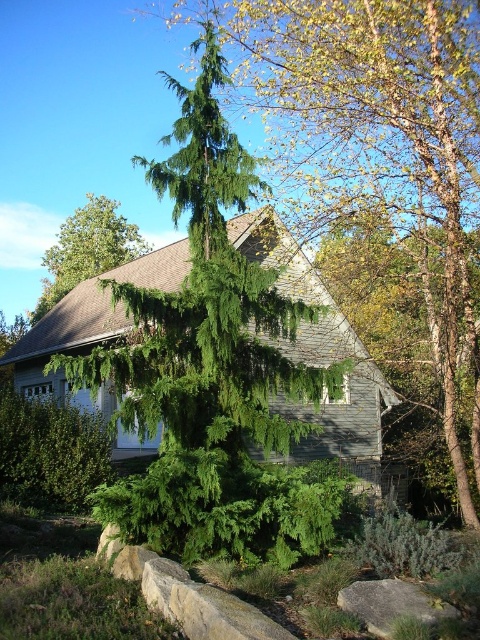
You are a drone operator trying to capture aerial footage of the gray wood cottage at center. The drone must maintain a minimum altitude of 10 meters above the ground. Given the cottage is located at coordinates point 0.562, 0.675, can you confirm if the drone can safely hover at this altitude without crashing into any obstacles?

The gray wood cottage at center is positioned at point (324, 358). Since the drone must stay at least 10 meters above the ground and there are no obstacles mentioned in the scene description, the drone can safely hover at the required altitude.

You are standing in front of the house and want to take a photo. There are two points marked in the image, point [85,305] and point [58,237]. Which point is closer to your camera?

Point [85,305] is closer to the camera than point [58,237].